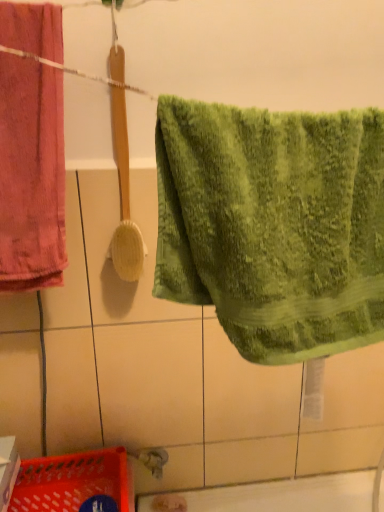
Question: Is wooden textured brush at center in front of velvety pink towel at left, which ranks as the 1th towel in back-to-front order?

Choices:
 (A) yes
 (B) no

Answer: (B)

Question: Are wooden textured brush at center and velvety pink towel at left, acting as the 1th towel starting from the left, beside each other?

Choices:
 (A) yes
 (B) no

Answer: (B)

Question: Does wooden textured brush at center have a lesser height compared to velvety pink towel at left, the 2th towel from the right?

Choices:
 (A) no
 (B) yes

Answer: (A)

Question: Does wooden textured brush at center come behind velvety pink towel at left, which ranks as the 1th towel in back-to-front order?

Choices:
 (A) yes
 (B) no

Answer: (A)

Question: From a real-world perspective, is wooden textured brush at center positioned under velvety pink towel at left, acting as the 1th towel starting from the left, based on gravity?

Choices:
 (A) yes
 (B) no

Answer: (B)

Question: Is point (72, 457) closer or farther from the camera than point (3, 57)?

Choices:
 (A) closer
 (B) farther

Answer: (B)

Question: Considering the relative positions of translucent plastic basket at lower left and velvety pink towel at left, acting as the 1th towel starting from the left, in the image provided, is translucent plastic basket at lower left to the left or to the right of velvety pink towel at left, acting as the 1th towel starting from the left,?

Choices:
 (A) left
 (B) right

Answer: (B)

Question: Relative to velvety pink towel at left, acting as the 1th towel starting from the left, is translucent plastic basket at lower left in front or behind?

Choices:
 (A) behind
 (B) front

Answer: (A)

Question: Looking at the image, does translucent plastic basket at lower left seem bigger or smaller compared to velvety pink towel at left, which ranks as the 1th towel in back-to-front order?

Choices:
 (A) small
 (B) big

Answer: (A)

Question: Is point (228, 330) closer or farther from the camera than point (139, 273)?

Choices:
 (A) farther
 (B) closer

Answer: (B)

Question: From the image's perspective, is green textured towel at center, which appears as the first towel when viewed from the front, positioned above or below wooden textured brush at center?

Choices:
 (A) above
 (B) below

Answer: (B)

Question: In the image, is green textured towel at center, placed as the 1th towel when sorted from right to left, positioned in front of or behind wooden textured brush at center?

Choices:
 (A) behind
 (B) front

Answer: (B)

Question: From their relative heights in the image, would you say green textured towel at center, placed as the 1th towel when sorted from right to left, is taller or shorter than wooden textured brush at center?

Choices:
 (A) short
 (B) tall

Answer: (A)

Question: Is point (129, 208) positioned closer to the camera than point (349, 247)?

Choices:
 (A) farther
 (B) closer

Answer: (A)

Question: Would you say wooden textured brush at center is to the left or to the right of green textured towel at center, which ranks as the second towel in left-to-right order, in the picture?

Choices:
 (A) left
 (B) right

Answer: (A)